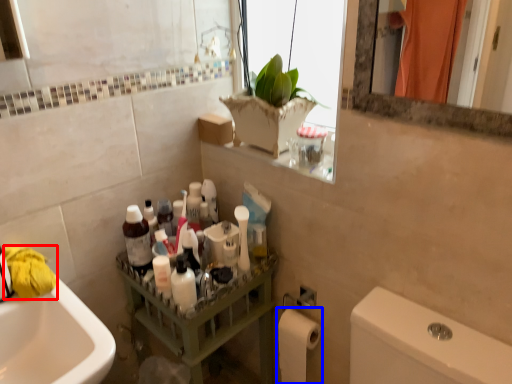
Question: Which of the following is the closest to the observer, material (highlighted by a red box) or toilet paper (highlighted by a blue box)?

Choices:
 (A) material
 (B) toilet paper

Answer: (A)